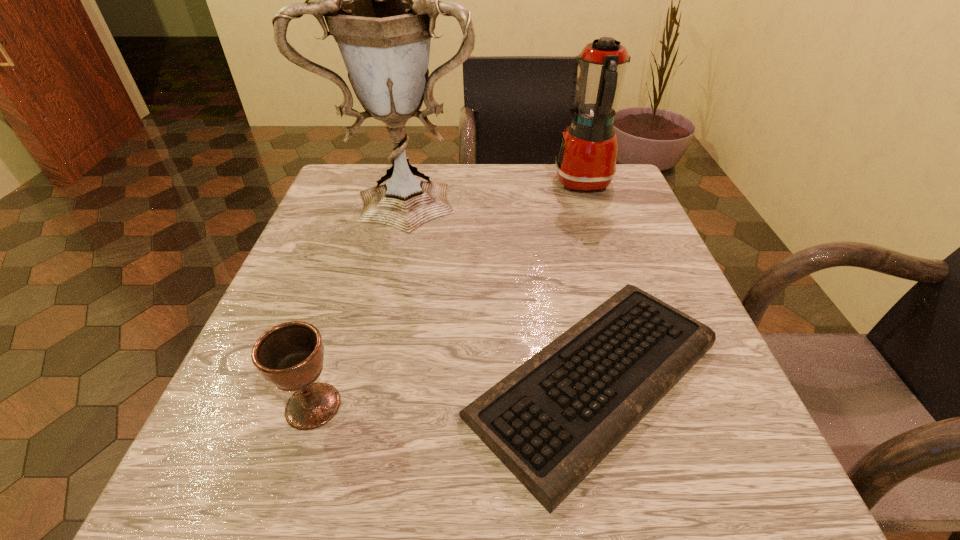
Locate an element on the screen. vacant space that satisfies the following two spatial constraints: 1. on the back side of the second shortest object; 2. on the left side of the computer keyboard is located at coordinates (322, 380).